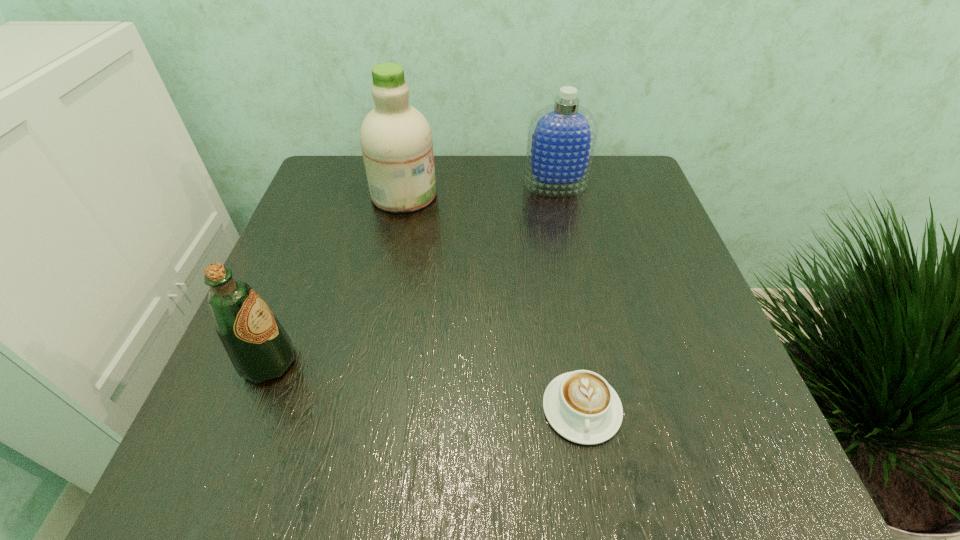
Find the location of a particular element. The image size is (960, 540). the tallest object is located at coordinates (396, 140).

Where is `the taller cleansing agent`? The image size is (960, 540). the taller cleansing agent is located at coordinates (396, 140).

Identify the location of the right cleansing agent. (562, 136).

Find the location of a particular element. olive oil is located at coordinates (259, 348).

I want to click on the shortest object, so click(x=581, y=406).

The image size is (960, 540). I want to click on vacant space located on the front label of the left cleansing agent, so click(x=473, y=194).

Find the location of `vacant area situated 0.210m on the left of the right cleansing agent`. vacant area situated 0.210m on the left of the right cleansing agent is located at coordinates (442, 184).

Locate an element on the screen. blank space located on the front-facing side of the olive oil is located at coordinates (500, 362).

Identify the location of free region located with the handle on the right side of the cappuccino. Image resolution: width=960 pixels, height=540 pixels. (595, 489).

This screenshot has width=960, height=540. Find the location of `object at the near edge`. object at the near edge is located at coordinates (581, 406).